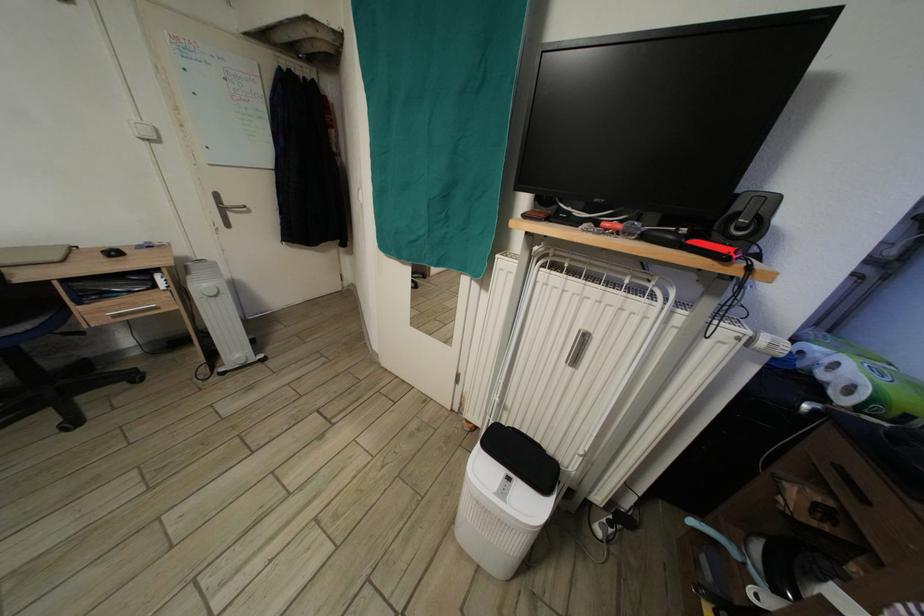
Find where to pull the silver door handle. Please return your answer as a coordinate pair (x, y).

(222, 208)